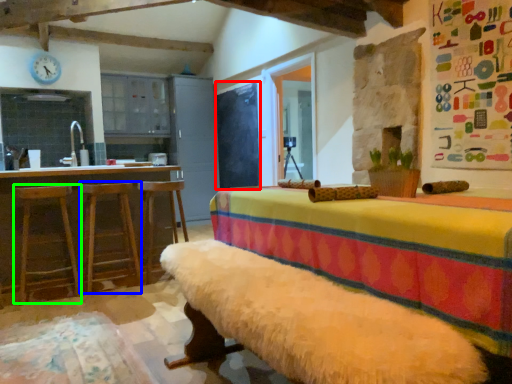
Question: Based on their relative distances, which object is farther from bulletin board (highlighted by a red box)? Choose from bar stool (highlighted by a blue box) and bar stool (highlighted by a green box).

Choices:
 (A) bar stool
 (B) bar stool

Answer: (B)